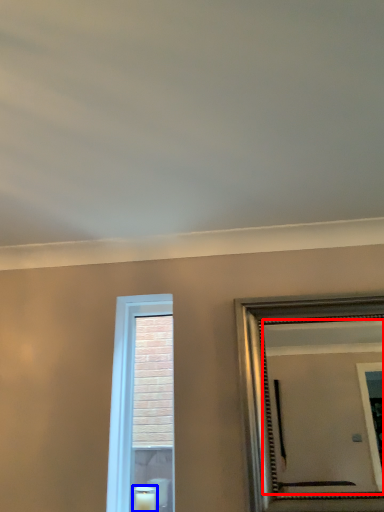
Question: Which object appears closest to the camera in this image, mirror (highlighted by a red box) or candle (highlighted by a blue box)?

Choices:
 (A) mirror
 (B) candle

Answer: (A)